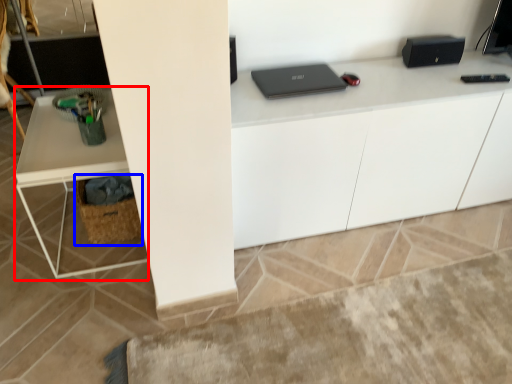
Question: Which of the following is the farthest to the observer, computer desk (highlighted by a red box) or basket (highlighted by a blue box)?

Choices:
 (A) computer desk
 (B) basket

Answer: (B)